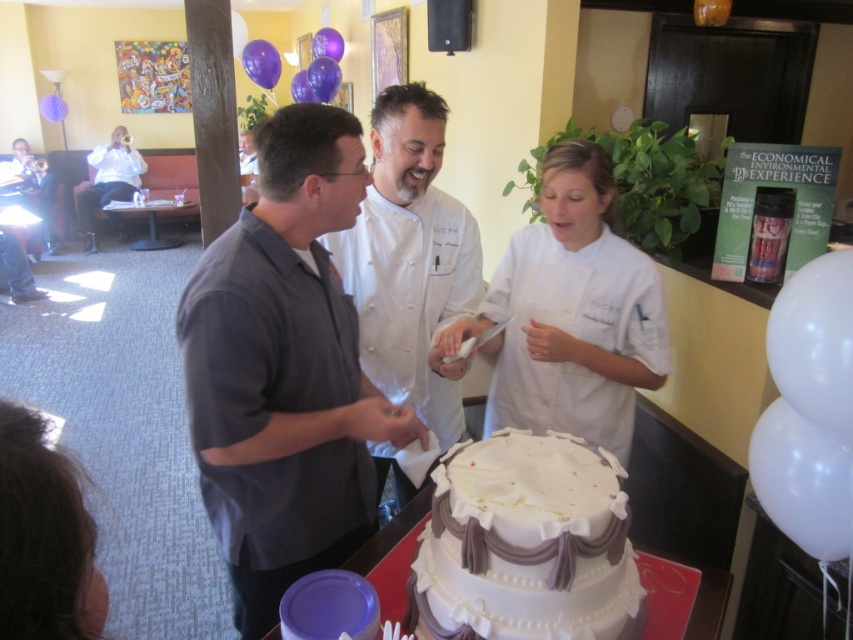
Can you confirm if white matte chef coat at center is shorter than white chef coat at center?

No, white matte chef coat at center is not shorter than white chef coat at center.

The image size is (853, 640). Describe the element at coordinates (408, 269) in the screenshot. I see `white matte chef coat at center` at that location.

I want to click on white matte chef coat at center, so click(x=408, y=269).

Does white fondant cake at center lie in front of white smooth chef coat at center?

Yes, it is in front of white smooth chef coat at center.

What do you see at coordinates (525, 541) in the screenshot?
I see `white fondant cake at center` at bounding box center [525, 541].

Between point (456, 570) and point (540, 228), which one is positioned in front?

Point (456, 570)

Where is `white fondant cake at center`? The height and width of the screenshot is (640, 853). white fondant cake at center is located at coordinates (525, 541).

Does white matte chef coat at center have a larger size compared to white fondant cake at center?

Correct, white matte chef coat at center is larger in size than white fondant cake at center.

Does point (340, 557) come behind point (457, 637)?

That is True.

Does point (410, 129) lie behind point (460, 579)?

Yes.

Locate an element on the screen. This screenshot has width=853, height=640. white matte chef coat at center is located at coordinates (408, 269).